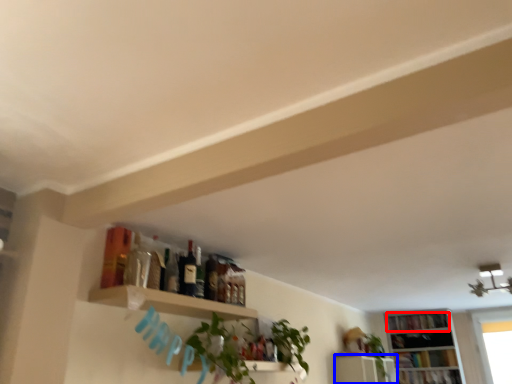
Question: Which object appears farthest to the camera in this image, book (highlighted by a red box) or shelf (highlighted by a blue box)?

Choices:
 (A) book
 (B) shelf

Answer: (A)